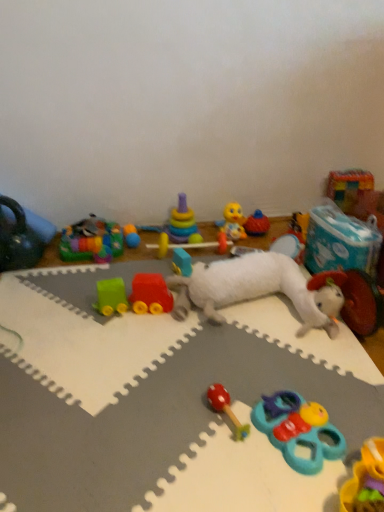
Where is `vacant space in rubberized plastic toy at center, which is the tenth toy in right-to-left order (from a real-world perspective)`? vacant space in rubberized plastic toy at center, which is the tenth toy in right-to-left order (from a real-world perspective) is located at coordinates (x=193, y=253).